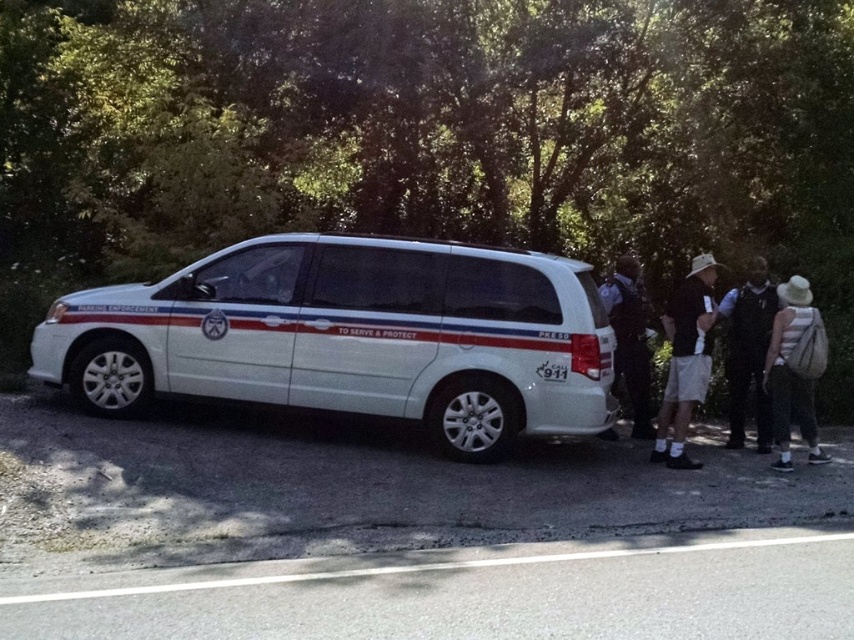
What do you see at coordinates (686, 358) in the screenshot?
I see `khaki shorts at right` at bounding box center [686, 358].

Between khaki shorts at right and dark blue uniform at center, which one appears on the right side from the viewer's perspective?

Positioned to the right is khaki shorts at right.

Locate an element on the screen. khaki shorts at right is located at coordinates (686, 358).

Describe the element at coordinates (351, 337) in the screenshot. I see `white glossy minivan at center` at that location.

Where is `white glossy minivan at center`? The image size is (854, 640). white glossy minivan at center is located at coordinates (351, 337).

Does point (167, 339) come behind point (638, 307)?

No, (167, 339) is in front of (638, 307).

You are a GUI agent. You are given a task and a screenshot of the screen. Output one action in this format:
    pyautogui.click(x=<x>, y=<y>)
    Task: Click on the white glossy minivan at center
    The height and width of the screenshot is (640, 854).
    Given the screenshot: What is the action you would take?
    click(351, 337)

Can you confirm if white glossy minivan at center is bigger than white striped shirt at right?

Correct, white glossy minivan at center is larger in size than white striped shirt at right.

Does white glossy minivan at center have a smaller size compared to white striped shirt at right?

No.

Find the location of a particular element. white glossy minivan at center is located at coordinates (351, 337).

The height and width of the screenshot is (640, 854). What are the coordinates of `white glossy minivan at center` in the screenshot? It's located at (351, 337).